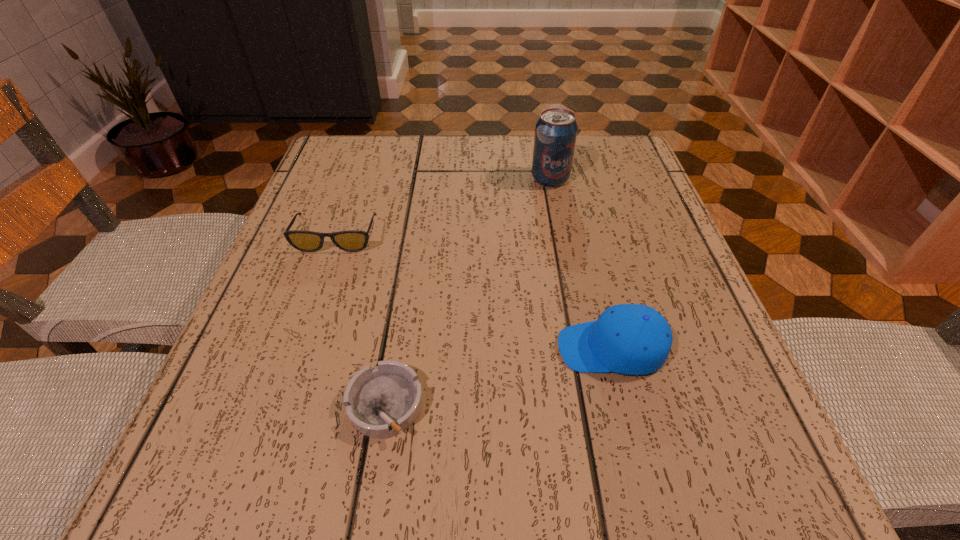
Select which object is the second closest to the farthest object. Please provide its 2D coordinates. Your answer should be formatted as a tuple, i.e. [(x, y)], where the tuple contains the x and y coordinates of a point satisfying the conditions above.

[(631, 339)]

Point out which object is positioned as the nearest to the second object from left to right. Please provide its 2D coordinates. Your answer should be formatted as a tuple, i.e. [(x, y)], where the tuple contains the x and y coordinates of a point satisfying the conditions above.

[(631, 339)]

You are a GUI agent. You are given a task and a screenshot of the screen. Output one action in this format:
    pyautogui.click(x=<x>, y=<y>)
    Task: Click on the blank space that satisfies the following two spatial constraints: 1. on the front-facing side of the second tallest object; 2. on the front side of the shortest object
    Image resolution: width=960 pixels, height=540 pixels.
    Given the screenshot: What is the action you would take?
    [626, 406]

Identify the location of free point that satisfies the following two spatial constraints: 1. on the front-facing side of the leftmost object; 2. on the right side of the ashtray. This screenshot has width=960, height=540. (278, 406).

At what (x,y) coordinates should I click in order to perform the action: click on free space that satisfies the following two spatial constraints: 1. on the front-facing side of the leftmost object; 2. on the left side of the third object from right to left. Please return your answer as a coordinate pair (x, y). Image resolution: width=960 pixels, height=540 pixels. Looking at the image, I should click on tap(278, 406).

I want to click on free region that satisfies the following two spatial constraints: 1. on the front-facing side of the sunglasses; 2. on the left side of the second object from left to right, so click(278, 406).